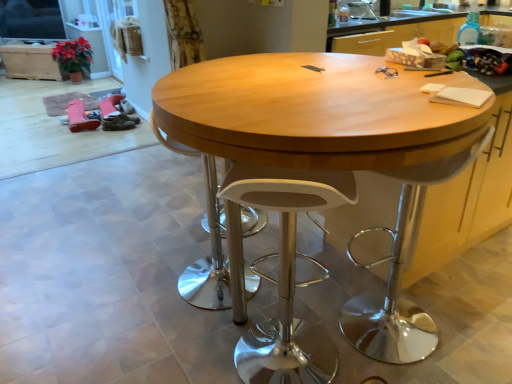
Where is `free space to the left of white plastic swivel chair at center, the first swivel chair when ordered from left to right`? free space to the left of white plastic swivel chair at center, the first swivel chair when ordered from left to right is located at coordinates (138, 285).